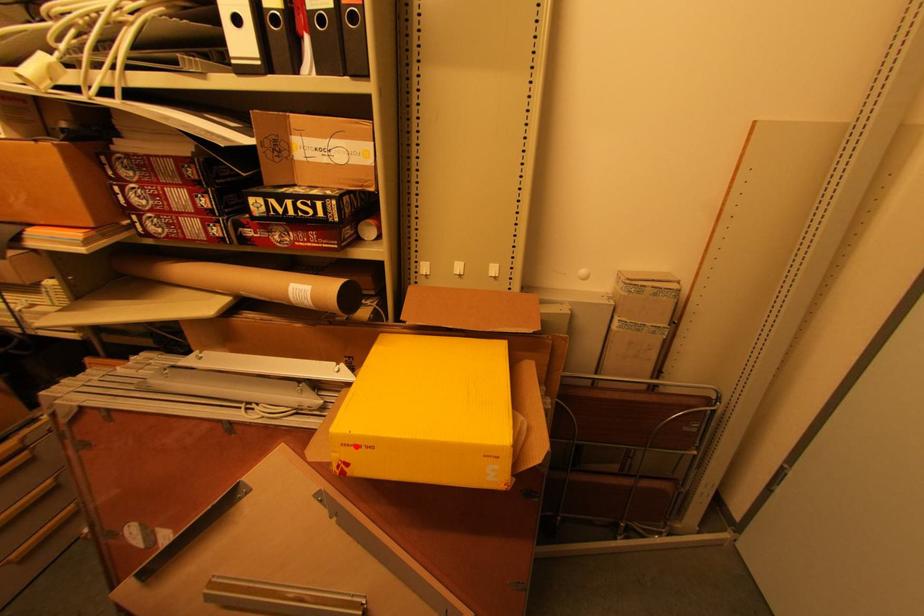
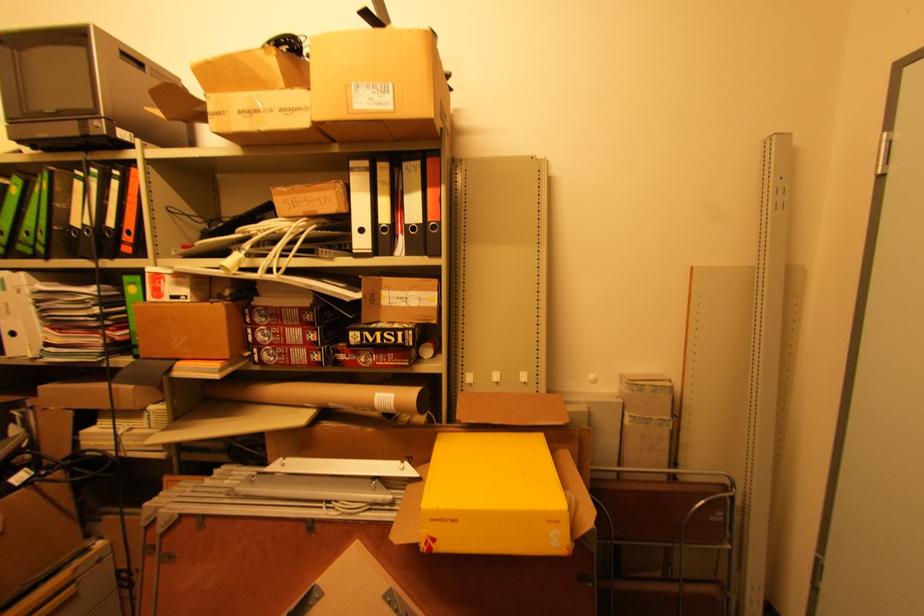
Question: I am providing you with two images of the same scene from different viewpoints. A red point is marked on the first image. Can you still see the location of the red point in image 2?

Choices:
 (A) Yes
 (B) No

Answer: (A)